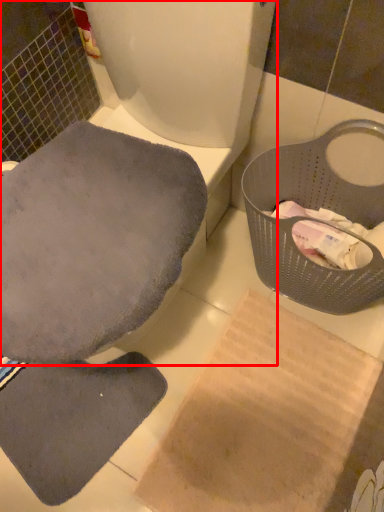
Question: Where is toilet (annotated by the red box) located in relation to basket container in the image?

Choices:
 (A) left
 (B) right

Answer: (A)